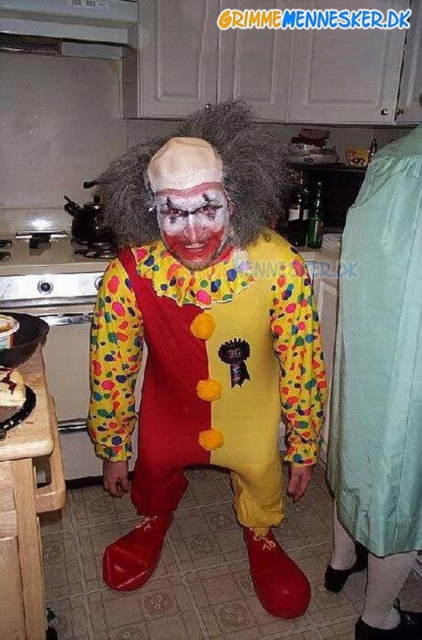
You are a stagehand setting up for a clown performance. You need to place a 30 cm long prop pole between the matte yellow clown suit at center and the light blue fabric at right. Will the pole fit between them?

The distance between the matte yellow clown suit at center and the light blue fabric at right is 30.71 centimeters. Since the prop pole is 30 cm long, it will fit with a small amount of space remaining.

You are a photographer trying to capture the clown in the kitchen. When you look through your camera lens, which object, the fuzzy brown wig at center or the matte clown face at center, will appear closer to you?

The fuzzy brown wig at center will appear closer to you because the matte clown face at center is behind it.

You are a photographer setting up a shoot in this kitchen. You have a matte yellow clown suit at center and a light blue fabric at right. Which object is wider?

The matte yellow clown suit at center might be wider than light blue fabric at right.